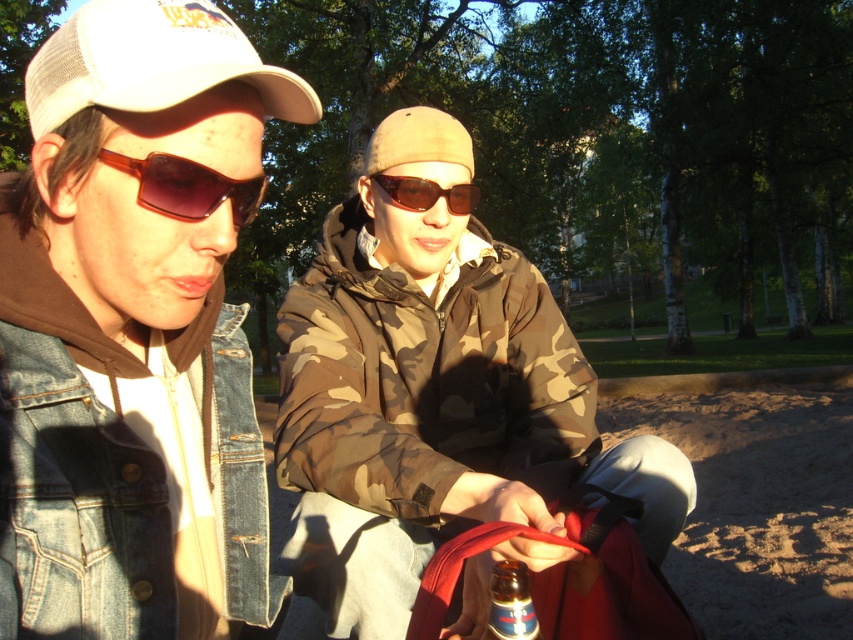
Can you confirm if denim jacket at upper left is wider than metallic silver bottle at center?

Correct, the width of denim jacket at upper left exceeds that of metallic silver bottle at center.

Consider the image. Which is below, denim jacket at upper left or metallic silver bottle at center?

metallic silver bottle at center is lower down.

This screenshot has width=853, height=640. Identify the location of denim jacket at upper left. (131, 326).

Identify the location of denim jacket at upper left. (131, 326).

Consider the image. Is denim jacket at upper left in front of brown matte sunglasses at left?

Result: Yes, denim jacket at upper left is in front of brown matte sunglasses at left.

Consider the image. Who is positioned more to the left, denim jacket at upper left or brown matte sunglasses at left?

denim jacket at upper left

Between point (119, 566) and point (254, 214), which one is positioned behind?

Point (254, 214)

At what (x,y) coordinates should I click in order to perform the action: click on denim jacket at upper left. Please return your answer as a coordinate pair (x, y). The width and height of the screenshot is (853, 640). Looking at the image, I should click on (131, 326).

The height and width of the screenshot is (640, 853). What are the coordinates of `white mesh baseball cap at upper left` in the screenshot? It's located at (152, 61).

Can you confirm if white mesh baseball cap at upper left is bigger than metallic silver bottle at center?

Yes.

Measure the distance between white mesh baseball cap at upper left and camera.

white mesh baseball cap at upper left and camera are 26.85 inches apart.

Where is `white mesh baseball cap at upper left`? The height and width of the screenshot is (640, 853). white mesh baseball cap at upper left is located at coordinates (152, 61).